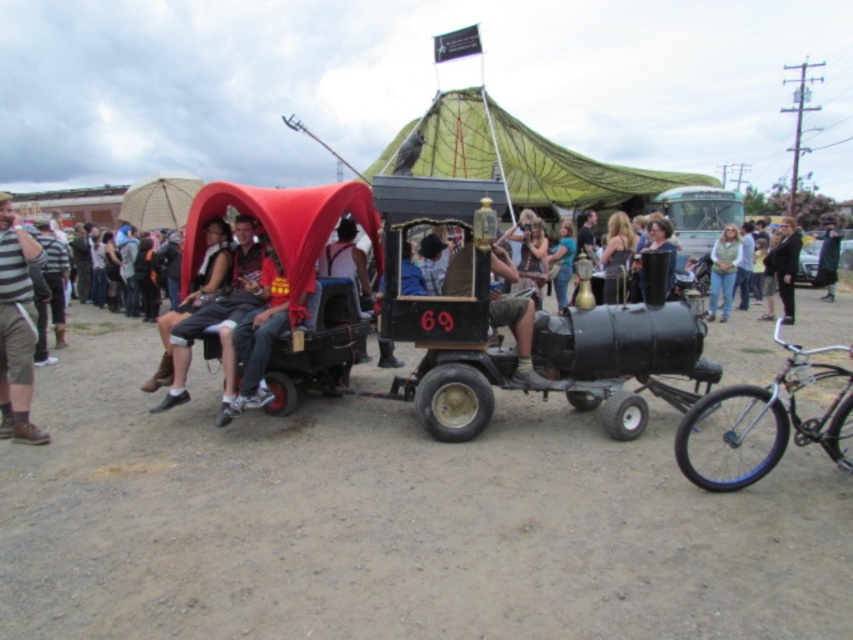
Question: Which is farther from the denim jacket at center?

Choices:
 (A) striped fabric pants at left
 (B) black matte steam engine at center
 (C) matte black shorts at center
 (D) dirt field at center

Answer: (A)

Question: Considering the relative positions of dirt field at center and denim jacket at center in the image provided, where is dirt field at center located with respect to denim jacket at center?

Choices:
 (A) below
 (B) above

Answer: (A)

Question: Is matte black shorts at center smaller than denim jacket at center?

Choices:
 (A) yes
 (B) no

Answer: (A)

Question: Which of the following is the farthest from the observer?

Choices:
 (A) denim jacket at center
 (B) dark gray suit at center

Answer: (A)

Question: Is matte black shorts at center wider than striped fabric pants at left?

Choices:
 (A) yes
 (B) no

Answer: (A)

Question: Which object is closer to the camera taking this photo?

Choices:
 (A) dark gray suit at center
 (B) striped fabric pants at left
 (C) black matte steam engine at center
 (D) shiny silver bicycle at lower right

Answer: (D)